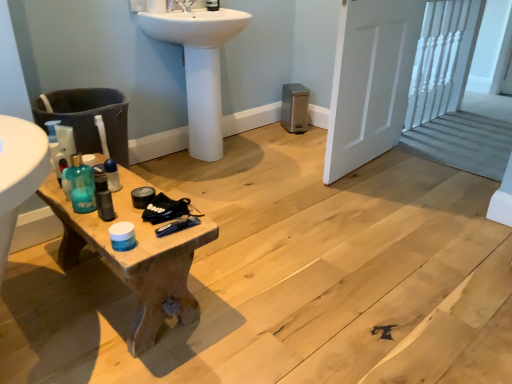
Image resolution: width=512 pixels, height=384 pixels. I want to click on free space below white glossy sink at upper center (from a real-world perspective), so click(215, 156).